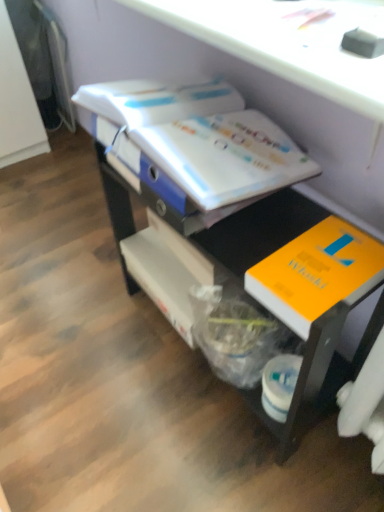
Question: Is orange matte book at lower right, marked as the 2th book in a top-to-bottom arrangement, bigger than white glossy book at upper center, which ranks as the first book in top-to-bottom order?

Choices:
 (A) yes
 (B) no

Answer: (B)

Question: Is orange matte book at lower right, acting as the first book starting from the bottom, thinner than white glossy book at upper center, which ranks as the first book in top-to-bottom order?

Choices:
 (A) yes
 (B) no

Answer: (A)

Question: Is orange matte book at lower right, marked as the 2th book in a top-to-bottom arrangement, closer to the viewer compared to white glossy book at upper center, the 2th book ordered from the bottom?

Choices:
 (A) yes
 (B) no

Answer: (A)

Question: From a real-world perspective, does orange matte book at lower right, acting as the first book starting from the bottom, sit lower than white glossy book at upper center, which ranks as the first book in top-to-bottom order?

Choices:
 (A) no
 (B) yes

Answer: (B)

Question: From the image's perspective, is orange matte book at lower right, marked as the 2th book in a top-to-bottom arrangement, under white glossy book at upper center, which ranks as the first book in top-to-bottom order?

Choices:
 (A) no
 (B) yes

Answer: (B)

Question: Is white glossy book at upper center, which ranks as the first book in top-to-bottom order, wider or thinner than matte black drawer at center?

Choices:
 (A) thin
 (B) wide

Answer: (A)

Question: From the image's perspective, is white glossy book at upper center, the 2th book ordered from the bottom, above or below matte black drawer at center?

Choices:
 (A) below
 (B) above

Answer: (B)

Question: Is point (134, 119) closer or farther from the camera than point (170, 315)?

Choices:
 (A) farther
 (B) closer

Answer: (B)

Question: Based on their sizes in the image, would you say white glossy book at upper center, which ranks as the first book in top-to-bottom order, is bigger or smaller than matte black drawer at center?

Choices:
 (A) small
 (B) big

Answer: (A)

Question: Is orange matte book at lower right, acting as the first book starting from the bottom, in front of or behind matte black drawer at center in the image?

Choices:
 (A) behind
 (B) front

Answer: (A)

Question: Considering the positions of orange matte book at lower right, marked as the 2th book in a top-to-bottom arrangement, and matte black drawer at center in the image, is orange matte book at lower right, marked as the 2th book in a top-to-bottom arrangement, taller or shorter than matte black drawer at center?

Choices:
 (A) tall
 (B) short

Answer: (B)

Question: Is point (344, 249) closer or farther from the camera than point (359, 367)?

Choices:
 (A) closer
 (B) farther

Answer: (A)

Question: Looking at the image, does orange matte book at lower right, acting as the first book starting from the bottom, seem bigger or smaller compared to matte black drawer at center?

Choices:
 (A) small
 (B) big

Answer: (A)

Question: Would you say orange matte book at lower right, marked as the 2th book in a top-to-bottom arrangement, is to the left or to the right of white glossy book at upper center, the 2th book ordered from the bottom, in the picture?

Choices:
 (A) right
 (B) left

Answer: (A)

Question: Do you think orange matte book at lower right, marked as the 2th book in a top-to-bottom arrangement, is within white glossy book at upper center, which ranks as the first book in top-to-bottom order, or outside of it?

Choices:
 (A) inside
 (B) outside

Answer: (B)